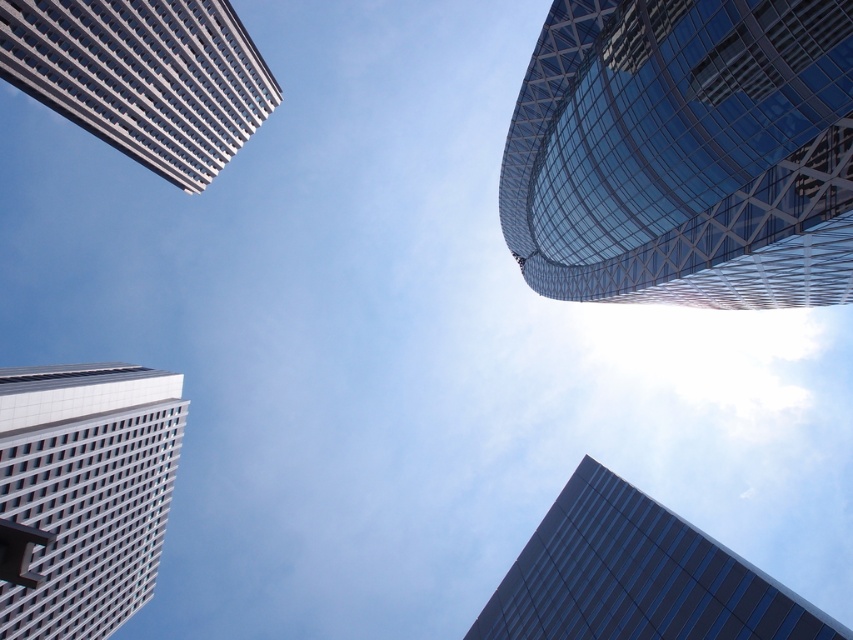
Question: Among these points, which one is nearest to the camera?

Choices:
 (A) (233, 116)
 (B) (820, 300)
 (C) (628, 570)
 (D) (57, 413)

Answer: (C)

Question: Which point is farther to the camera?

Choices:
 (A) white grid-patterned building at lower left
 (B) white glass building at upper left
 (C) dark blue glass building at lower right
 (D) transparent glass building at upper right

Answer: (B)

Question: Which of these objects is positioned closest to the white grid-patterned building at lower left?

Choices:
 (A) transparent glass building at upper right
 (B) dark blue glass building at lower right

Answer: (A)

Question: Is white grid-patterned building at lower left positioned behind dark blue glass building at lower right?

Choices:
 (A) no
 (B) yes

Answer: (A)

Question: Is white glass building at upper left above dark blue glass building at lower right?

Choices:
 (A) yes
 (B) no

Answer: (A)

Question: In this image, where is white grid-patterned building at lower left located relative to white glass building at upper left?

Choices:
 (A) left
 (B) right

Answer: (B)